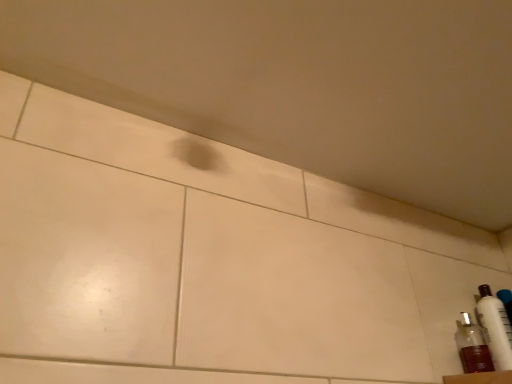
Question: Considering the relative sizes of translucent plastic bottle at lower right, the 2th bottle viewed from the right, and white glossy bottle at lower right, placed as the 2th bottle when sorted from left to right, in the image provided, is translucent plastic bottle at lower right, the 2th bottle viewed from the right, shorter than white glossy bottle at lower right, placed as the 2th bottle when sorted from left to right,?

Choices:
 (A) yes
 (B) no

Answer: (A)

Question: From a real-world perspective, is translucent plastic bottle at lower right, which is counted as the first bottle, starting from the left, physically below white glossy bottle at lower right, which ranks as the first bottle in right-to-left order?

Choices:
 (A) no
 (B) yes

Answer: (B)

Question: Is white glossy bottle at lower right, placed as the 2th bottle when sorted from left to right, surrounded by translucent plastic bottle at lower right, the 2th bottle viewed from the right?

Choices:
 (A) yes
 (B) no

Answer: (B)

Question: Is translucent plastic bottle at lower right, which is counted as the first bottle, starting from the left, positioned in front of white glossy bottle at lower right, placed as the 2th bottle when sorted from left to right?

Choices:
 (A) no
 (B) yes

Answer: (B)

Question: Is translucent plastic bottle at lower right, the 2th bottle viewed from the right, facing away from white glossy bottle at lower right, placed as the 2th bottle when sorted from left to right?

Choices:
 (A) no
 (B) yes

Answer: (A)

Question: Does translucent plastic bottle at lower right, which is counted as the first bottle, starting from the left, lie behind white glossy bottle at lower right, which ranks as the first bottle in right-to-left order?

Choices:
 (A) no
 (B) yes

Answer: (A)

Question: Can you confirm if white glossy bottle at lower right, which ranks as the first bottle in right-to-left order, is shorter than translucent plastic bottle at lower right, the 2th bottle viewed from the right?

Choices:
 (A) yes
 (B) no

Answer: (B)

Question: Is white glossy bottle at lower right, which ranks as the first bottle in right-to-left order, positioned behind translucent plastic bottle at lower right, which is counted as the first bottle, starting from the left?

Choices:
 (A) no
 (B) yes

Answer: (B)

Question: Would you say white glossy bottle at lower right, placed as the 2th bottle when sorted from left to right, is outside translucent plastic bottle at lower right, which is counted as the first bottle, starting from the left?

Choices:
 (A) yes
 (B) no

Answer: (A)

Question: From a real-world perspective, is white glossy bottle at lower right, placed as the 2th bottle when sorted from left to right, under translucent plastic bottle at lower right, the 2th bottle viewed from the right?

Choices:
 (A) no
 (B) yes

Answer: (A)

Question: From a real-world perspective, does white glossy bottle at lower right, which ranks as the first bottle in right-to-left order, stand above translucent plastic bottle at lower right, which is counted as the first bottle, starting from the left?

Choices:
 (A) no
 (B) yes

Answer: (B)

Question: Is translucent plastic bottle at lower right, which is counted as the first bottle, starting from the left, a part of white glossy bottle at lower right, placed as the 2th bottle when sorted from left to right?

Choices:
 (A) yes
 (B) no

Answer: (B)

Question: Relative to white glossy bottle at lower right, which ranks as the first bottle in right-to-left order, is translucent plastic bottle at lower right, the 2th bottle viewed from the right, in front or behind?

Choices:
 (A) front
 (B) behind

Answer: (A)